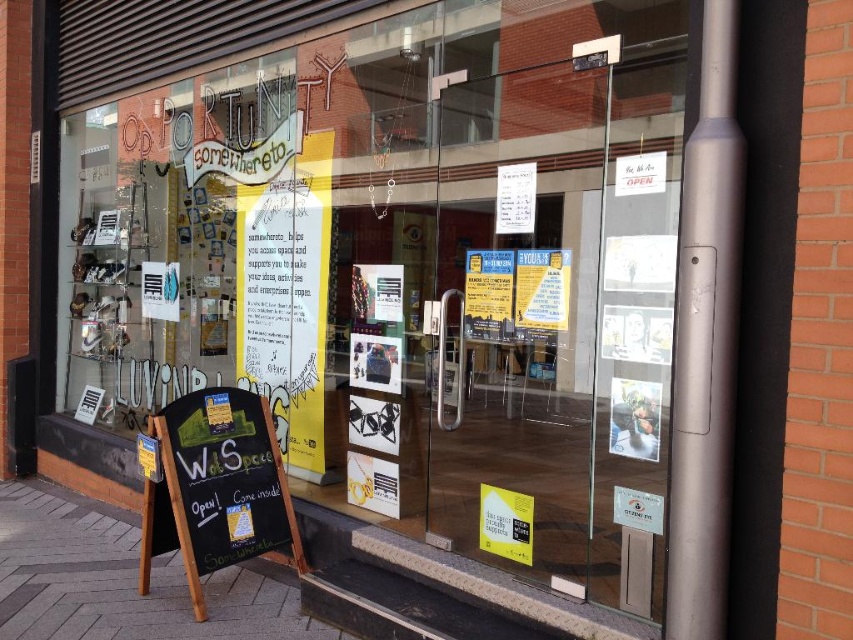
Does transparent glass shop window at center appear on the right side of black chalkboard at lower left?

Correct, you'll find transparent glass shop window at center to the right of black chalkboard at lower left.

Is point (561, 548) closer to camera compared to point (204, 506)?

Yes, it is.

Is point (271, 221) positioned after point (230, 445)?

Yes, it is behind point (230, 445).

The height and width of the screenshot is (640, 853). What are the coordinates of `transparent glass shop window at center` in the screenshot? It's located at (409, 272).